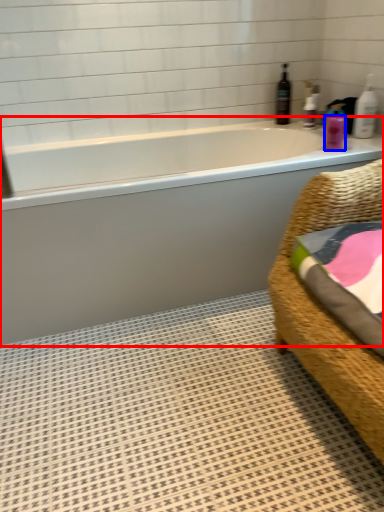
Question: Which object is further to the camera taking this photo, bathtub (highlighted by a red box) or toiletry (highlighted by a blue box)?

Choices:
 (A) bathtub
 (B) toiletry

Answer: (B)